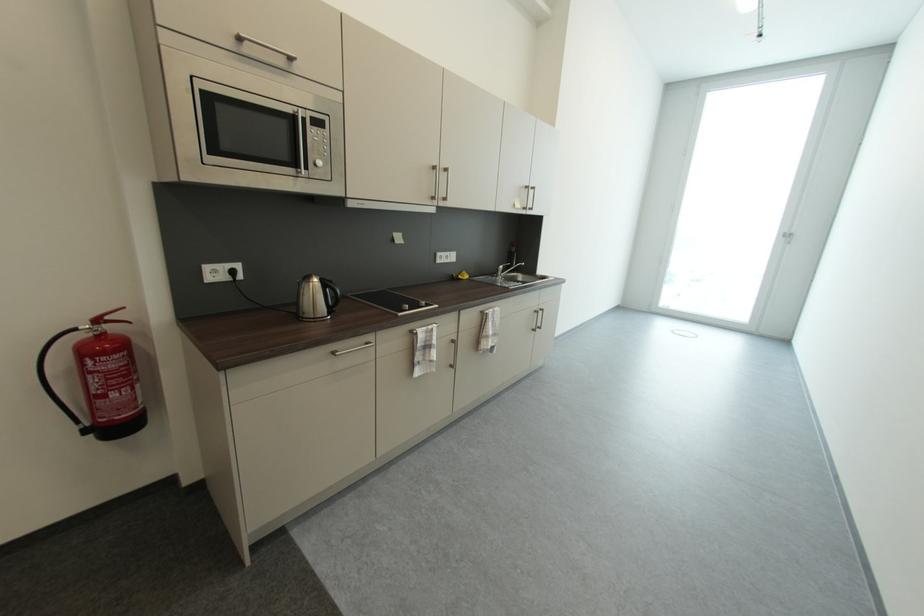
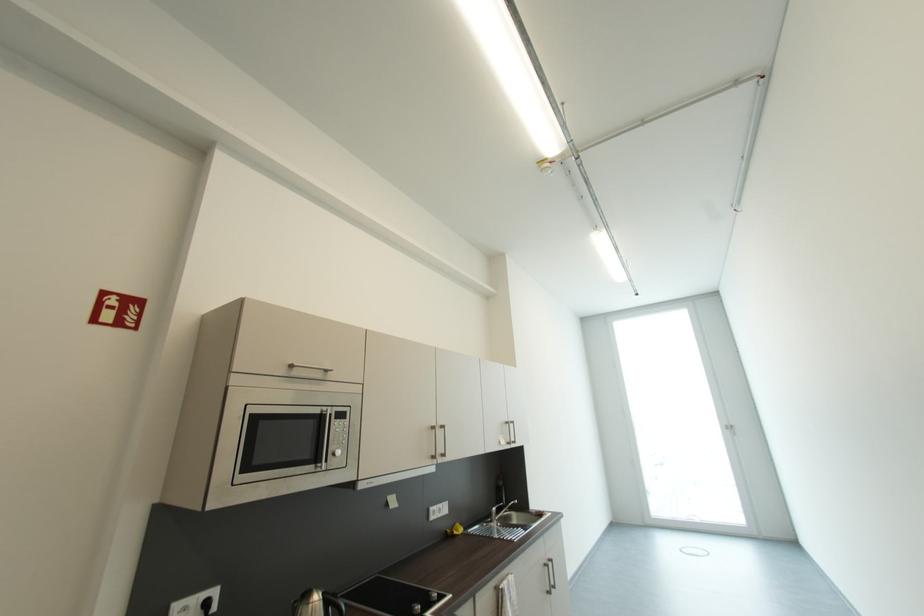
Locate, in the second image, the point that corresponds to [502,277] in the first image.

(495, 522)